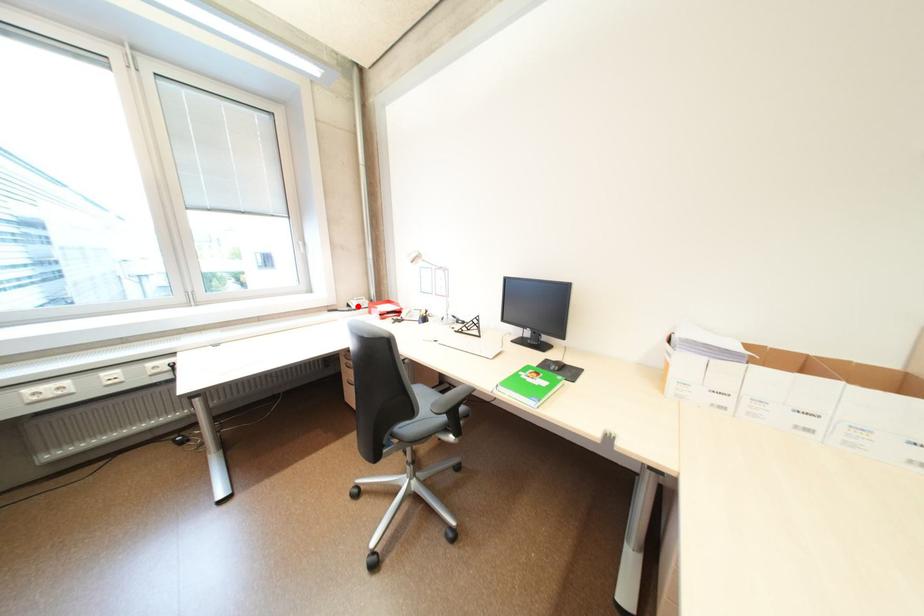
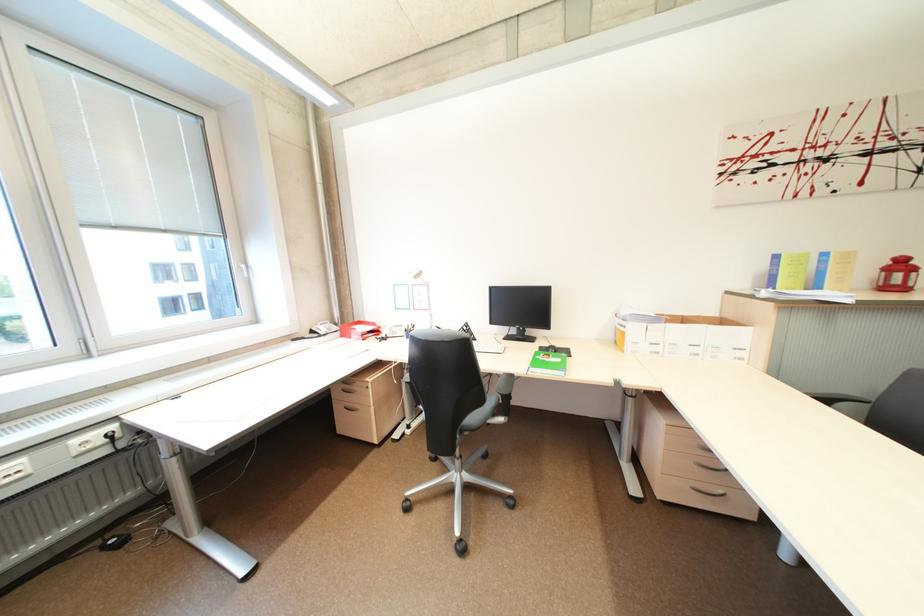
The point at the highlighted location is marked in the first image. Where is the corresponding point in the second image?

(321, 333)